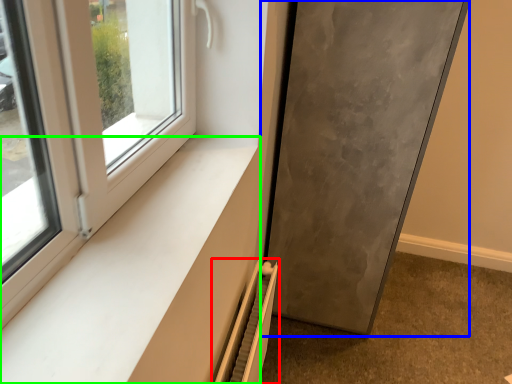
Question: Estimate the real-world distances between objects in this image. Which object is farther from radiator (highlighted by a red box), door (highlighted by a blue box) or window sill (highlighted by a green box)?

Choices:
 (A) door
 (B) window sill

Answer: (A)